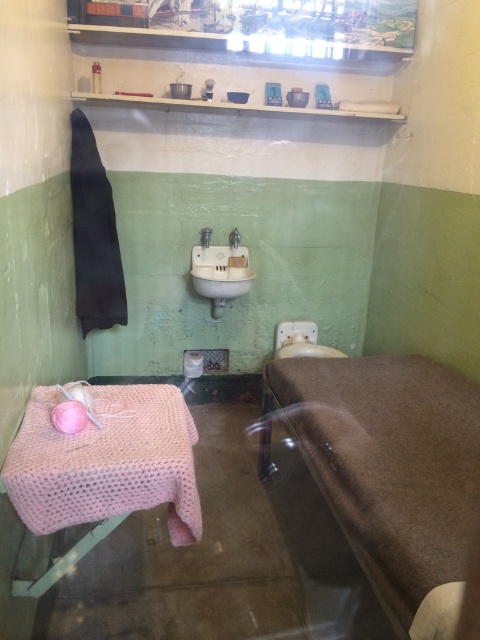
You are standing in the bathroom and need to place a tall plant on the highest available surface. Which object should you choose between the white glossy sink at center and the white plastic toilet bowl at center?

The white glossy sink at center has a greater height compared to the white plastic toilet bowl at center, so you should place the tall plant on the white glossy sink at center.

You are a plumber trying to replace the satin silver faucet at center. You need to access it but there is a white plastic toilet bowl at center in the way. Can you move the toilet bowl to the side to get to the faucet?

The white plastic toilet bowl at center might be wider than satin silver faucet at center, but since both are at the center, moving the toilet bowl could allow access to the faucet. However, the exact spatial relationship isn not fully clear from the description provided.